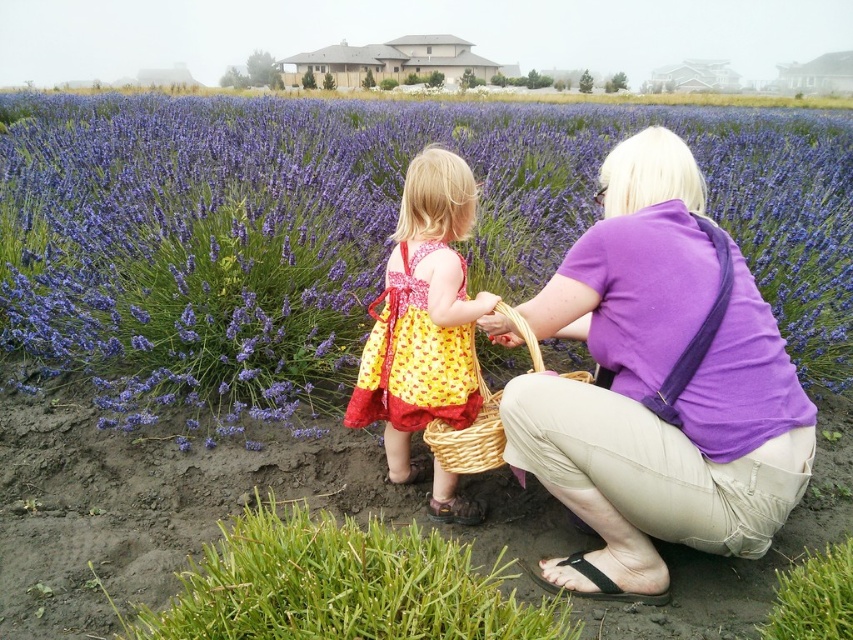
You are a photographer planning to capture a closeup shot of the yellow dotted fabric dress at center and the woven wicker basket at center. Given their sizes, which object should you focus on to ensure both are in frame without needing to adjust your camera angle?

The yellow dotted fabric dress at center has a smaller size compared to the woven wicker basket at center. To include both in the frame without adjusting the camera angle, focus on the larger object, the woven wicker basket at center, since it occupies more space and will help maintain both in view.

You are a photographer trying to capture the two subjects in the lavender field. You want to ensure the yellow printed dress at center is positioned to the left of the purple cotton shirt at center in the photo. Is this possible based on their current arrangement?

Yes, because the purple cotton shirt at center is already to the right of the yellow printed dress at center, so arranging them in the photo to have the yellow printed dress at center on the left and the purple cotton shirt at center on the right would naturally align with their current positions.